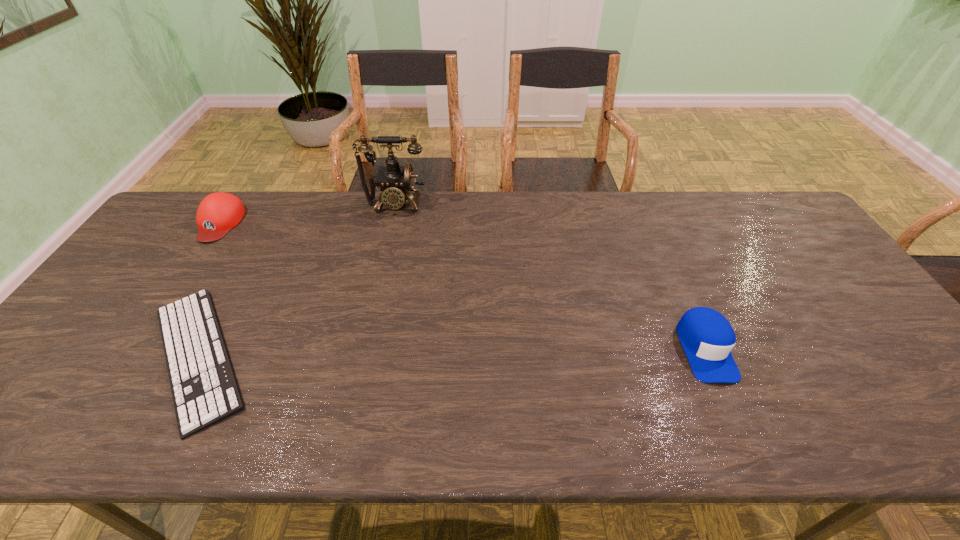
The image size is (960, 540). I want to click on free spot between the rightmost object and the farther baseball cap, so click(x=463, y=286).

You are a GUI agent. You are given a task and a screenshot of the screen. Output one action in this format:
    pyautogui.click(x=<x>, y=<y>)
    Task: Click on the empty space that is in between the right baseball cap and the left baseball cap
    
    Given the screenshot: What is the action you would take?
    pyautogui.click(x=463, y=286)

The image size is (960, 540). I want to click on free point between the second object from right to left and the left baseball cap, so click(308, 214).

Locate an element on the screen. This screenshot has width=960, height=540. vacant region between the second object from right to left and the farther baseball cap is located at coordinates (308, 214).

You are a GUI agent. You are given a task and a screenshot of the screen. Output one action in this format:
    pyautogui.click(x=<x>, y=<y>)
    Task: Click on the vacant space that is in between the second object from right to left and the computer keyboard
    This screenshot has height=540, width=960.
    Given the screenshot: What is the action you would take?
    pyautogui.click(x=297, y=281)

This screenshot has height=540, width=960. Find the location of `empty space between the computer keyboard and the second object from right to left`. empty space between the computer keyboard and the second object from right to left is located at coordinates (297, 281).

I want to click on vacant area that lies between the shortest object and the right baseball cap, so click(451, 353).

Image resolution: width=960 pixels, height=540 pixels. I want to click on free space between the left baseball cap and the tallest object, so [x=308, y=214].

Where is `vacant region between the farther baseball cap and the telephone`? The height and width of the screenshot is (540, 960). vacant region between the farther baseball cap and the telephone is located at coordinates tap(308, 214).

What are the coordinates of `empty space that is in between the telephone and the computer keyboard` in the screenshot? It's located at (297, 281).